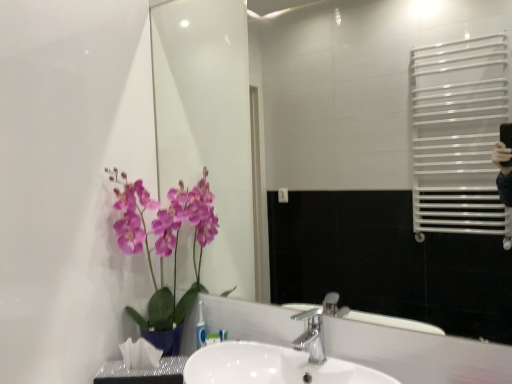
This screenshot has width=512, height=384. Find the location of `vacant space that is to the left of silver metallic faucet at center`. vacant space that is to the left of silver metallic faucet at center is located at coordinates (249, 357).